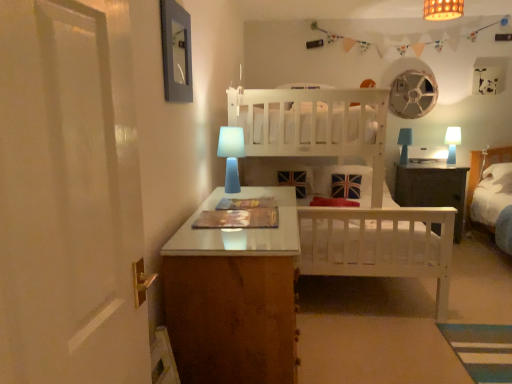
The height and width of the screenshot is (384, 512). Find the location of `vacant area situated below bamboo lampshade at upper center (from a real-world perspective)`. vacant area situated below bamboo lampshade at upper center (from a real-world perspective) is located at coordinates (419, 327).